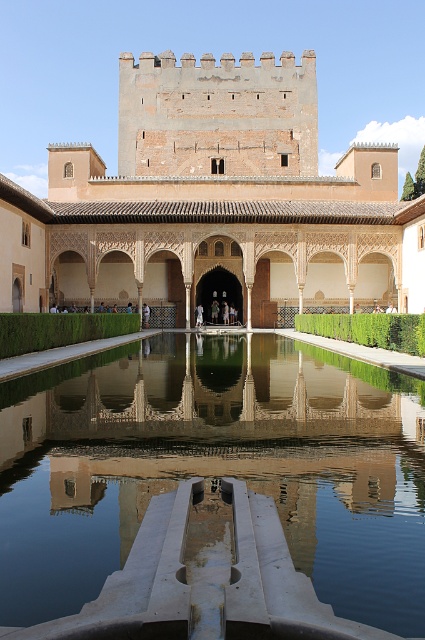
The image size is (425, 640). I want to click on clear glass water at center, so click(215, 467).